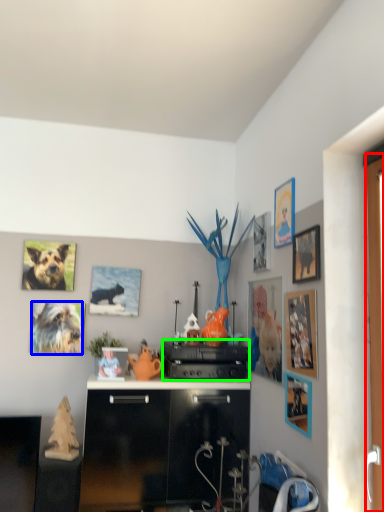
Question: Which is farther away from screen door (highlighted by a red box)? dog (highlighted by a blue box) or appliance (highlighted by a green box)?

Choices:
 (A) dog
 (B) appliance

Answer: (A)